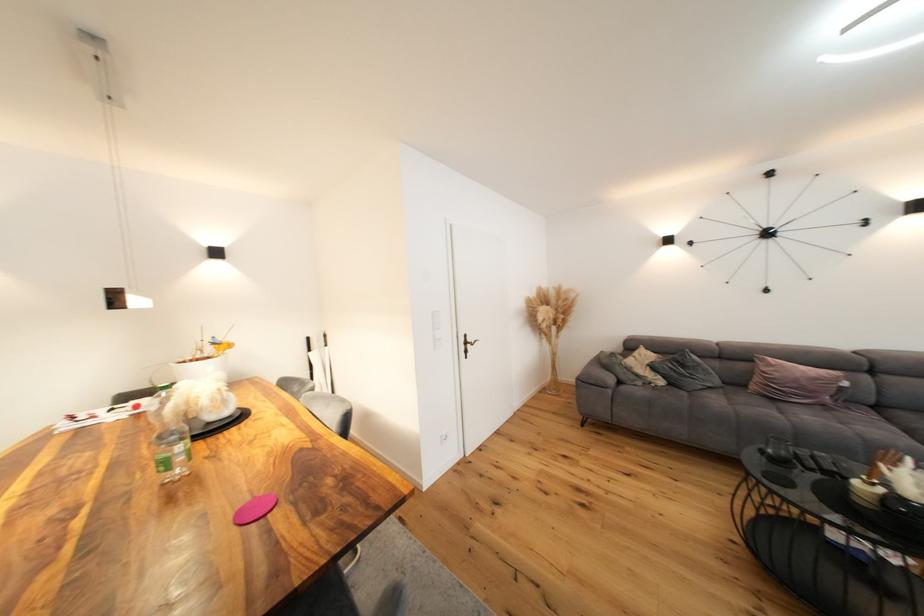
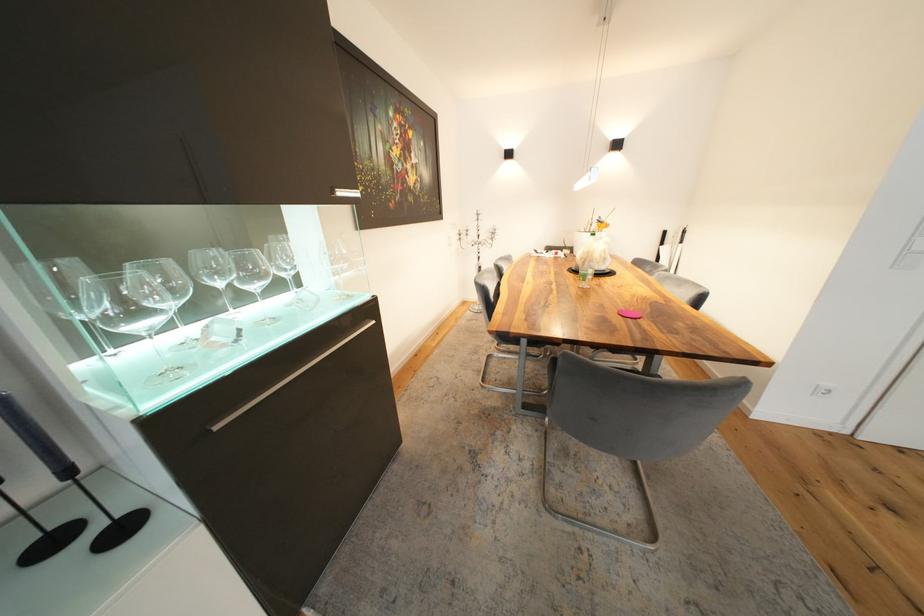
The first image is from the beginning of the video and the second image is from the end. How did the camera likely rotate when shooting the video?

The camera rotated toward left-down.